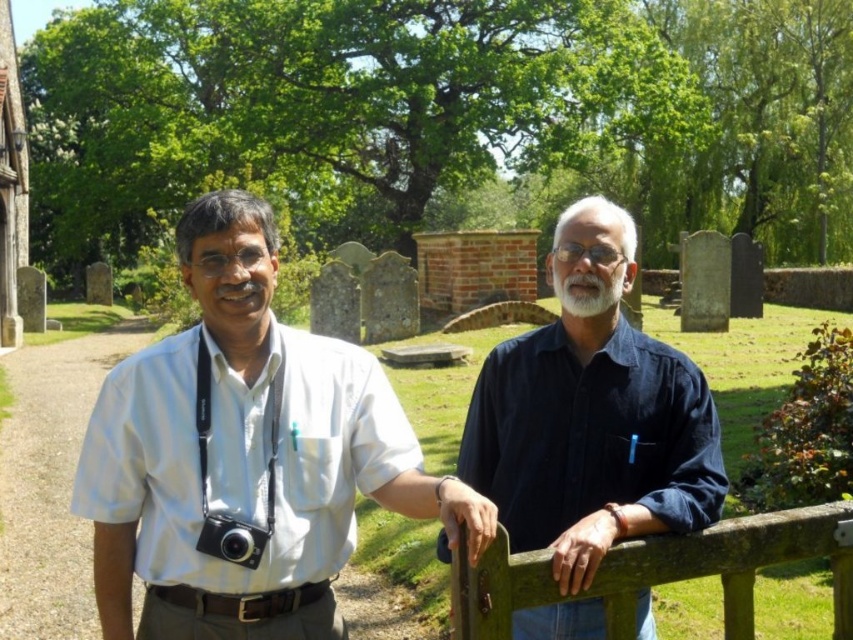
Can you confirm if dark blue shirt at center is positioned above black plastic camera at center?

Yes.

Does point (556, 333) come closer to viewer compared to point (236, 547)?

No, (556, 333) is behind (236, 547).

Is point (492, 369) positioned in front of point (206, 513)?

No, (492, 369) is further to viewer.

Where is `dark blue shirt at center`? This screenshot has height=640, width=853. dark blue shirt at center is located at coordinates (590, 420).

Does white matte shirt at center appear under brown wooden fence at right?

No.

Between point (183, 476) and point (608, 634), which one is positioned in front?

Point (608, 634) is in front.

Is point (160, 465) farther from camera compared to point (648, 566)?

Yes, it is behind point (648, 566).

Find the location of a particular element. The height and width of the screenshot is (640, 853). white matte shirt at center is located at coordinates (245, 454).

What do you see at coordinates (245, 454) in the screenshot?
I see `white matte shirt at center` at bounding box center [245, 454].

How distant is white matte shirt at center from white soft beard at center?

white matte shirt at center and white soft beard at center are 8.54 feet apart from each other.

Who is more distant from viewer, (271,458) or (576,310)?

Positioned behind is point (576,310).

You are a GUI agent. You are given a task and a screenshot of the screen. Output one action in this format:
    pyautogui.click(x=<x>, y=<y>)
    Task: Click on the white matte shirt at center
    
    Given the screenshot: What is the action you would take?
    pyautogui.click(x=245, y=454)